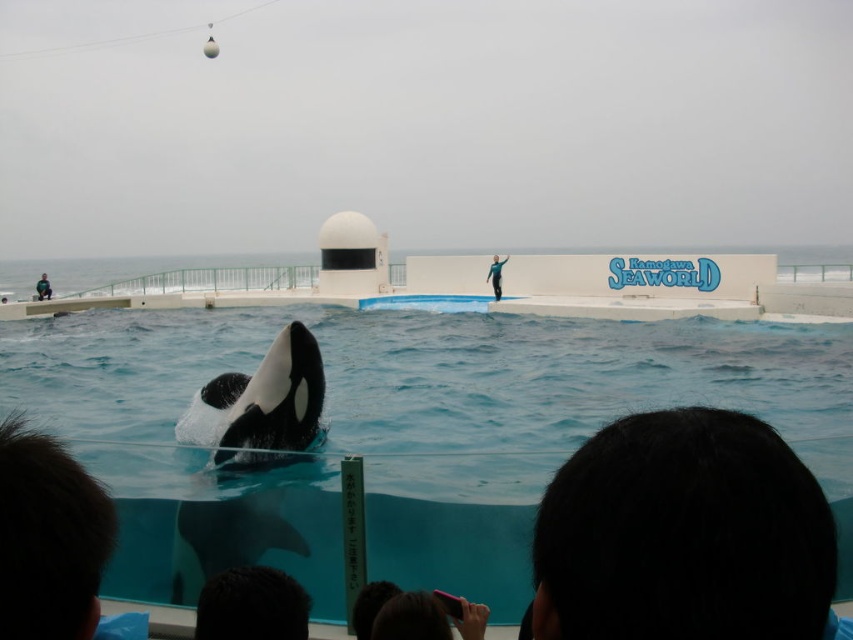
You are a visitor at Kamogawa Sea World and see the blue smooth water at center and the dark blue wetsuit at lower left. Which object is positioned higher from the ground?

The dark blue wetsuit at lower left is positioned higher than the blue smooth water at center because the blue smooth water at center is located below it.

You are a photographer at Kamogawa Sea World trying to capture the orca performance. You notice the blue smooth water at center and the dark hair at lower center in your frame. Which object takes up more space in the photo?

The blue smooth water at center takes up more space in the photo because it is bigger than the dark hair at lower center.

You are a photographer trying to capture the orca performance at Kamogawa Sea World. You have a camera with a wide angle lens that can capture large areas. Which object between the blue smooth water at center and the dark blue wetsuit at lower left would be better to focus on to ensure both the orca and the surrounding environment are in the frame?

The blue smooth water at center is larger in size than the dark blue wetsuit at lower left, so focusing on the blue smooth water at center would better ensure both the orca and the surrounding environment are captured in the frame.